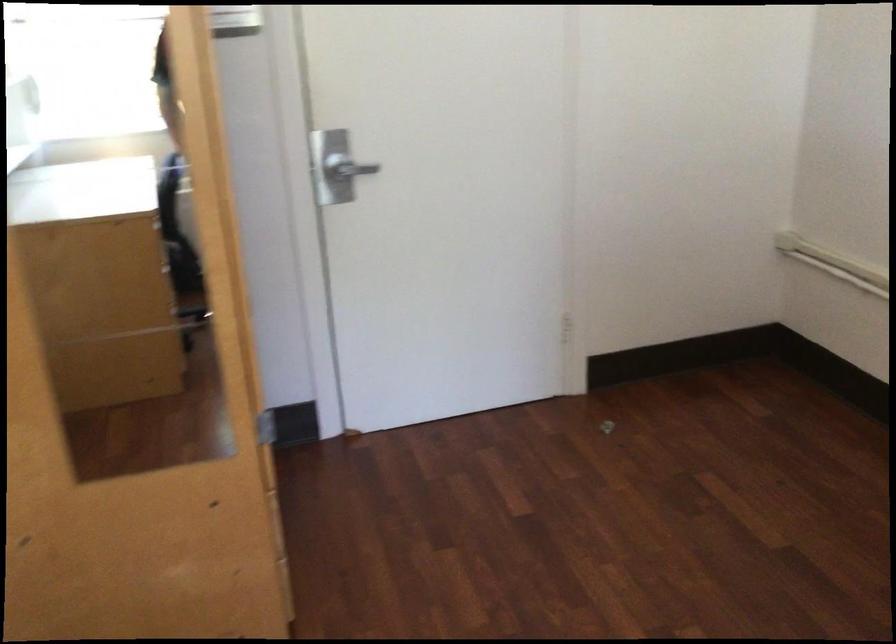
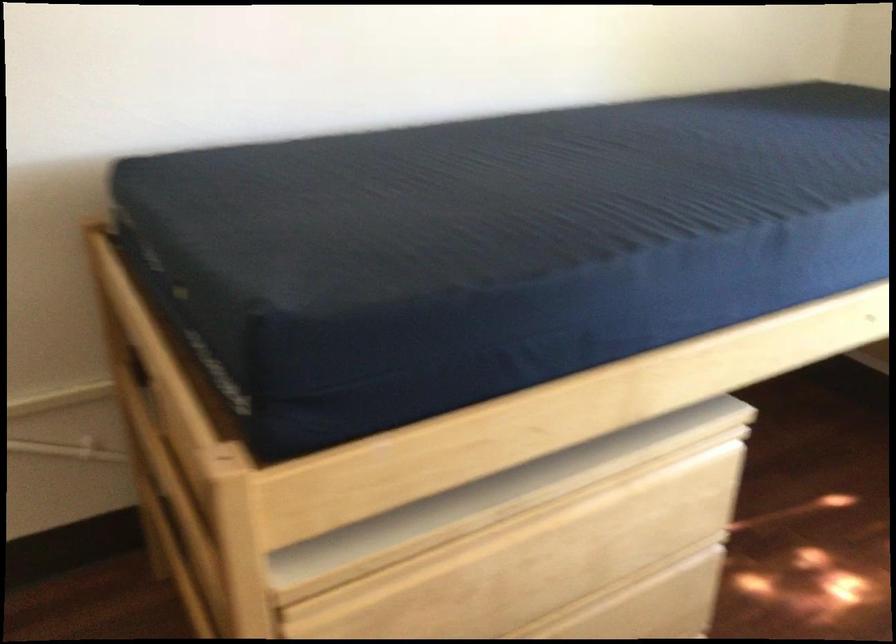
The images are taken continuously from a first-person perspective. In which direction is your viewpoint rotating?

The camera's rotation is toward right-down.